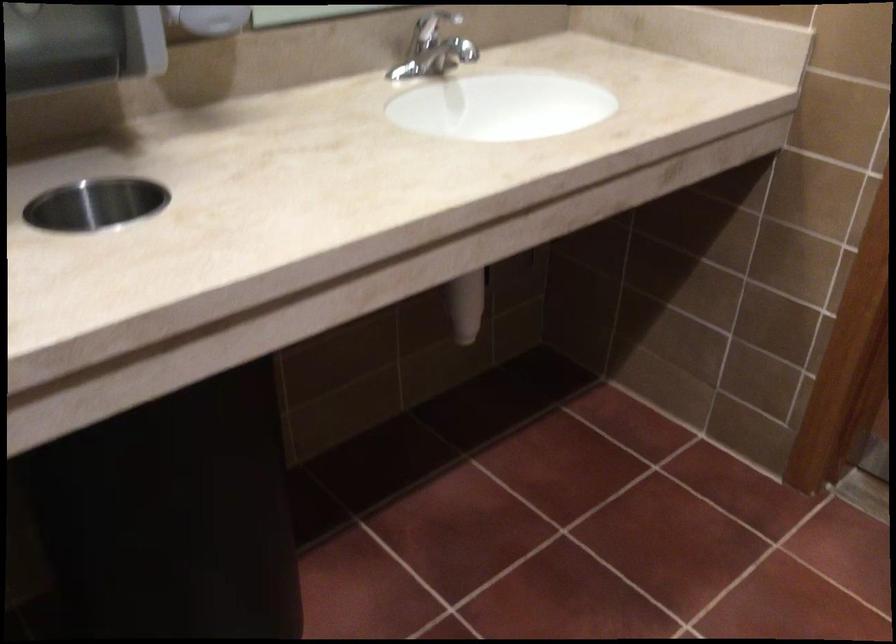
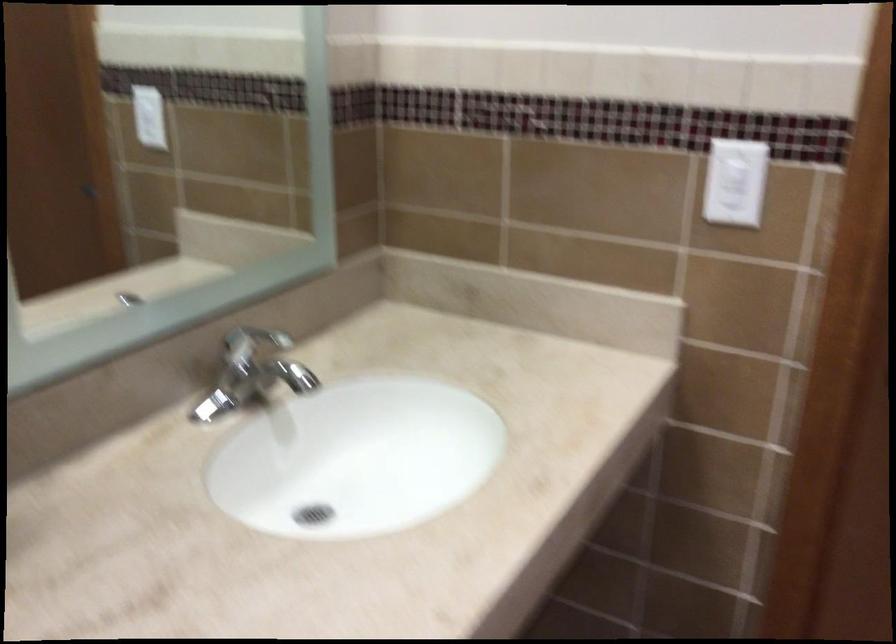
Question: Based on the continuous images, in which direction is the camera rotating? Reply with the corresponding letter.

Choices:
 (A) Left
 (B) Right
 (C) Up
 (D) Down

Answer: (B)